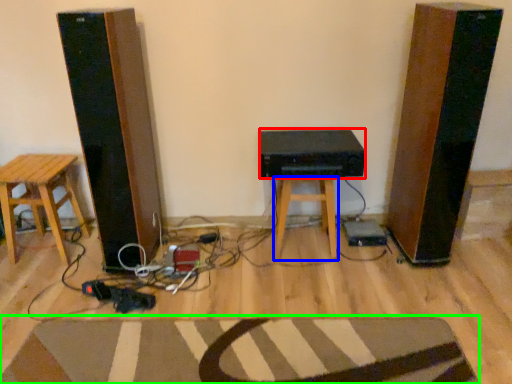
Question: Which object is the closest to the speaker (highlighted by a red box)? Choose among these: stool (highlighted by a blue box) or doormat (highlighted by a green box).

Choices:
 (A) stool
 (B) doormat

Answer: (A)